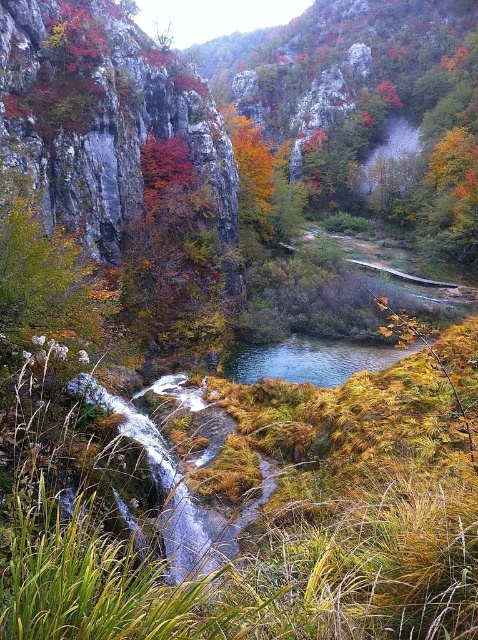
Question: Which of the following is the closest to the observer?

Choices:
 (A) rustic stone cliff at center
 (B) autumn leaves at center
 (C) green glossy water at center

Answer: (A)

Question: Which object appears closest to the camera in this image?

Choices:
 (A) rustic stone cliff at center
 (B) green glossy water at center
 (C) autumn leaves at center

Answer: (A)

Question: In this image, where is rustic stone cliff at center located relative to autumn leaves at center?

Choices:
 (A) below
 (B) above

Answer: (B)

Question: Can you confirm if rustic stone cliff at center is positioned to the right of green glossy water at center?

Choices:
 (A) no
 (B) yes

Answer: (A)

Question: Is autumn leaves at center smaller than green glossy water at center?

Choices:
 (A) no
 (B) yes

Answer: (A)

Question: Estimate the real-world distances between objects in this image. Which object is farther from the rustic stone cliff at center?

Choices:
 (A) autumn leaves at center
 (B) green glossy water at center

Answer: (B)